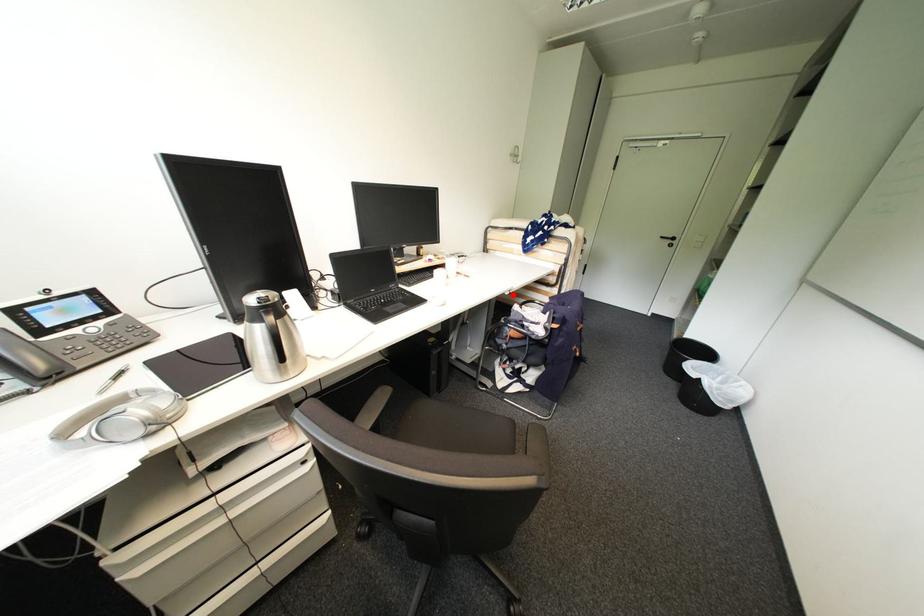
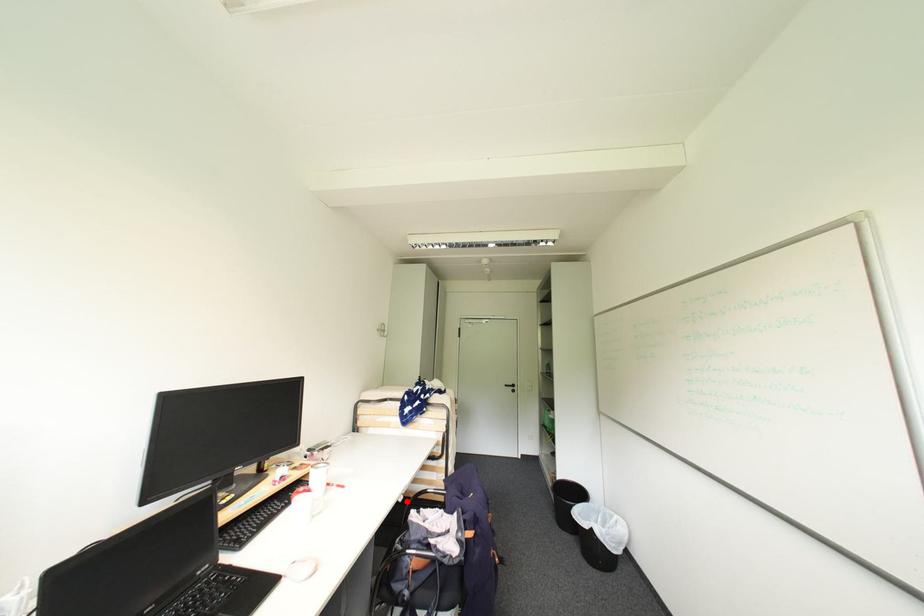
I am providing you with two images of the same scene from different viewpoints. A red point is marked on the first image and another point is marked on the second image. Is the marked point in image1 the same physical position as the marked point in image2?

Yes